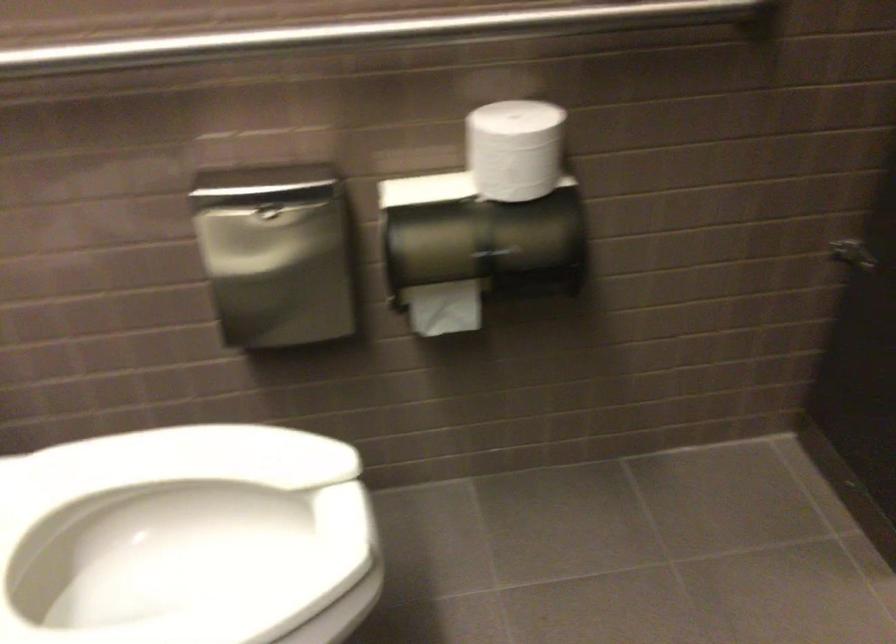
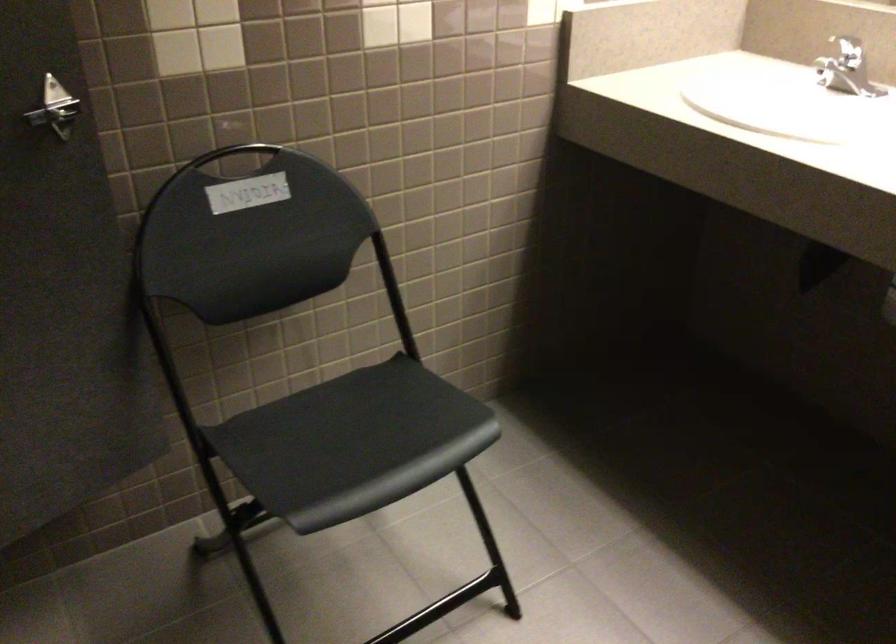
Question: What movement of the cameraman would produce the second image?

Choices:
 (A) Left
 (B) Right
 (C) Forward
 (D) Backward

Answer: (B)